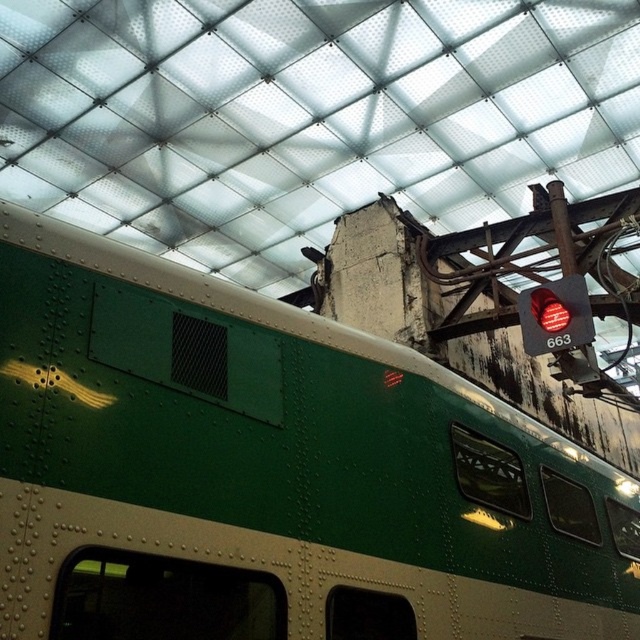
Question: Which point is farther to the camera?

Choices:
 (A) pos(211,598)
 (B) pos(557,280)

Answer: (B)

Question: Does green riveted metal train at center come behind red glass traffic light at upper right?

Choices:
 (A) no
 (B) yes

Answer: (A)

Question: Which point is farther to the camera?

Choices:
 (A) green riveted metal train at center
 (B) red glass traffic light at upper right

Answer: (B)

Question: Can you confirm if green riveted metal train at center is positioned to the left of red glass traffic light at upper right?

Choices:
 (A) no
 (B) yes

Answer: (B)

Question: Does green riveted metal train at center appear under red glass traffic light at upper right?

Choices:
 (A) no
 (B) yes

Answer: (B)